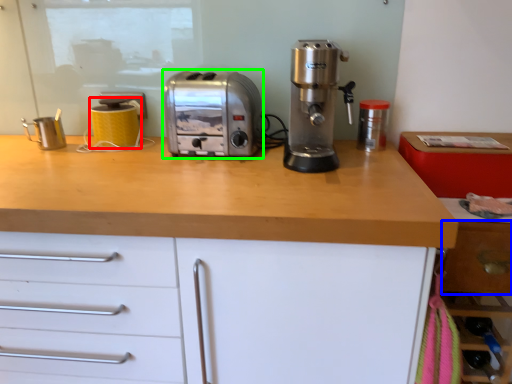
Question: Based on their relative distances, which object is farther from kitchen appliance (highlighted by a red box)? Choose from drawer (highlighted by a blue box) and toaster (highlighted by a green box).

Choices:
 (A) drawer
 (B) toaster

Answer: (A)